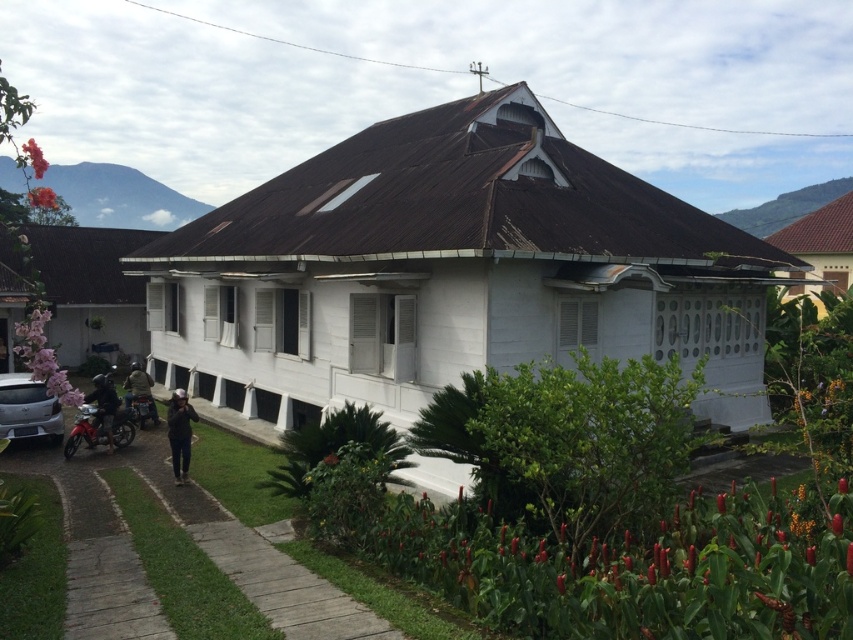
Question: Can you confirm if camouflage jacket at lower left is positioned to the left of metallic silver motorcycle at lower left?

Choices:
 (A) yes
 (B) no

Answer: (A)

Question: Does silver metallic car at lower left appear on the left side of camouflage jacket at lower left?

Choices:
 (A) no
 (B) yes

Answer: (A)

Question: Among these objects, which one is farthest from the camera?

Choices:
 (A) metallic red motorcycle at lower left
 (B) camouflage jacket at lower left

Answer: (B)

Question: Which of the following is the farthest from the observer?

Choices:
 (A) metallic silver motorcycle at lower left
 (B) dark gray fabric at center
 (C) dark blue helmet at lower left

Answer: (A)

Question: Which of these objects is positioned farthest from the dark blue helmet at lower left?

Choices:
 (A) metallic red motorcycle at lower left
 (B) dark gray fabric at center
 (C) camouflage jacket at lower left
 (D) metallic silver motorcycle at lower left

Answer: (C)

Question: In this image, where is silver metallic car at lower left located relative to dark blue helmet at lower left?

Choices:
 (A) right
 (B) left

Answer: (B)